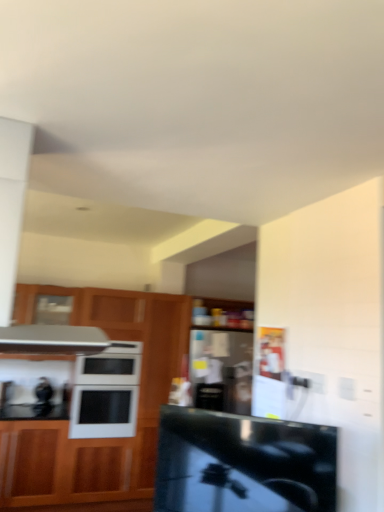
Question: Is the depth of black glossy countertop at center less than that of wooden cabinet at left?

Choices:
 (A) yes
 (B) no

Answer: (A)

Question: Can you confirm if black glossy countertop at center is shorter than wooden cabinet at left?

Choices:
 (A) yes
 (B) no

Answer: (A)

Question: From a real-world perspective, is black glossy countertop at center over wooden cabinet at left?

Choices:
 (A) yes
 (B) no

Answer: (A)

Question: From the image's perspective, is black glossy countertop at center over wooden cabinet at left?

Choices:
 (A) yes
 (B) no

Answer: (A)

Question: Does black glossy countertop at center have a lesser width compared to wooden cabinet at left?

Choices:
 (A) no
 (B) yes

Answer: (B)

Question: From the image's perspective, is black glossy countertop at center under wooden cabinet at left?

Choices:
 (A) no
 (B) yes

Answer: (A)

Question: Can you confirm if black glossy countertop at center is shorter than white glossy microwave oven at center?

Choices:
 (A) no
 (B) yes

Answer: (B)

Question: Is black glossy countertop at center at the right side of white glossy microwave oven at center?

Choices:
 (A) yes
 (B) no

Answer: (A)

Question: Can you confirm if black glossy countertop at center is smaller than white glossy microwave oven at center?

Choices:
 (A) no
 (B) yes

Answer: (B)

Question: Are black glossy countertop at center and white glossy microwave oven at center located far from each other?

Choices:
 (A) no
 (B) yes

Answer: (B)

Question: Can white glossy microwave oven at center be found inside black glossy countertop at center?

Choices:
 (A) yes
 (B) no

Answer: (B)

Question: Considering the relative sizes of black glossy countertop at center and white glossy microwave oven at center in the image provided, is black glossy countertop at center bigger than white glossy microwave oven at center?

Choices:
 (A) no
 (B) yes

Answer: (A)

Question: Considering the relative sizes of white glossy microwave oven at center and wooden cabinet at left in the image provided, is white glossy microwave oven at center smaller than wooden cabinet at left?

Choices:
 (A) yes
 (B) no

Answer: (A)